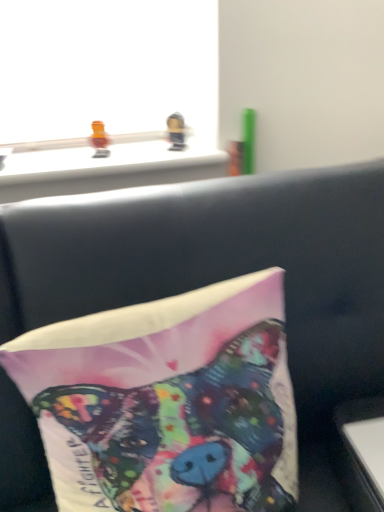
Question: Should I look upward or downward to see metallic gold toy at upper center, the 2th toy positioned from the left?

Choices:
 (A) down
 (B) up

Answer: (B)

Question: From the image's perspective, is white glossy table at lower right beneath translucent orange toy at upper left, the 1th toy viewed from the left?

Choices:
 (A) yes
 (B) no

Answer: (A)

Question: Is white glossy table at lower right closer to camera compared to translucent orange toy at upper left, arranged as the 2th toy when viewed from the right?

Choices:
 (A) no
 (B) yes

Answer: (B)

Question: Considering the relative sizes of white glossy table at lower right and translucent orange toy at upper left, arranged as the 2th toy when viewed from the right, in the image provided, is white glossy table at lower right shorter than translucent orange toy at upper left, arranged as the 2th toy when viewed from the right,?

Choices:
 (A) yes
 (B) no

Answer: (A)

Question: Can you confirm if white glossy table at lower right is positioned to the left of translucent orange toy at upper left, arranged as the 2th toy when viewed from the right?

Choices:
 (A) no
 (B) yes

Answer: (A)

Question: Can you confirm if white glossy table at lower right is taller than translucent orange toy at upper left, arranged as the 2th toy when viewed from the right?

Choices:
 (A) yes
 (B) no

Answer: (B)

Question: Are white glossy table at lower right and translucent orange toy at upper left, arranged as the 2th toy when viewed from the right, located far from each other?

Choices:
 (A) no
 (B) yes

Answer: (A)

Question: Can you confirm if translucent orange toy at upper left, the 1th toy viewed from the left, is positioned to the left of silky fabric pillow at center?

Choices:
 (A) yes
 (B) no

Answer: (A)

Question: Is translucent orange toy at upper left, arranged as the 2th toy when viewed from the right, far away from silky fabric pillow at center?

Choices:
 (A) no
 (B) yes

Answer: (A)

Question: Does translucent orange toy at upper left, arranged as the 2th toy when viewed from the right, have a smaller size compared to silky fabric pillow at center?

Choices:
 (A) yes
 (B) no

Answer: (A)

Question: Can you confirm if translucent orange toy at upper left, the 1th toy viewed from the left, is shorter than silky fabric pillow at center?

Choices:
 (A) no
 (B) yes

Answer: (B)

Question: From a real-world perspective, is translucent orange toy at upper left, the 1th toy viewed from the left, located beneath silky fabric pillow at center?

Choices:
 (A) no
 (B) yes

Answer: (A)

Question: Considering the relative sizes of translucent orange toy at upper left, the 1th toy viewed from the left, and silky fabric pillow at center in the image provided, is translucent orange toy at upper left, the 1th toy viewed from the left, bigger than silky fabric pillow at center?

Choices:
 (A) yes
 (B) no

Answer: (B)

Question: Is white glossy table at lower right not inside silky fabric pillow at center?

Choices:
 (A) no
 (B) yes

Answer: (B)